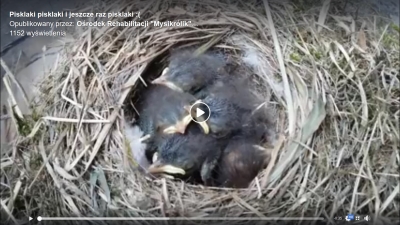
Locate an element on the screen. This screenshot has height=225, width=400. bar is located at coordinates (85, 216).